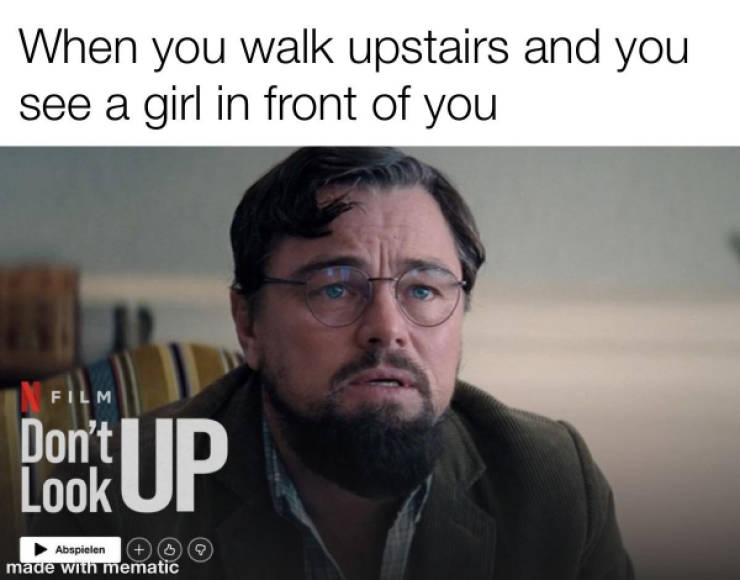
At what (x,y) coordinates should I click in order to perform the action: click on striped chair. Please return your answer as a coordinate pair (x, y). This screenshot has width=740, height=580. Looking at the image, I should click on (164, 357).